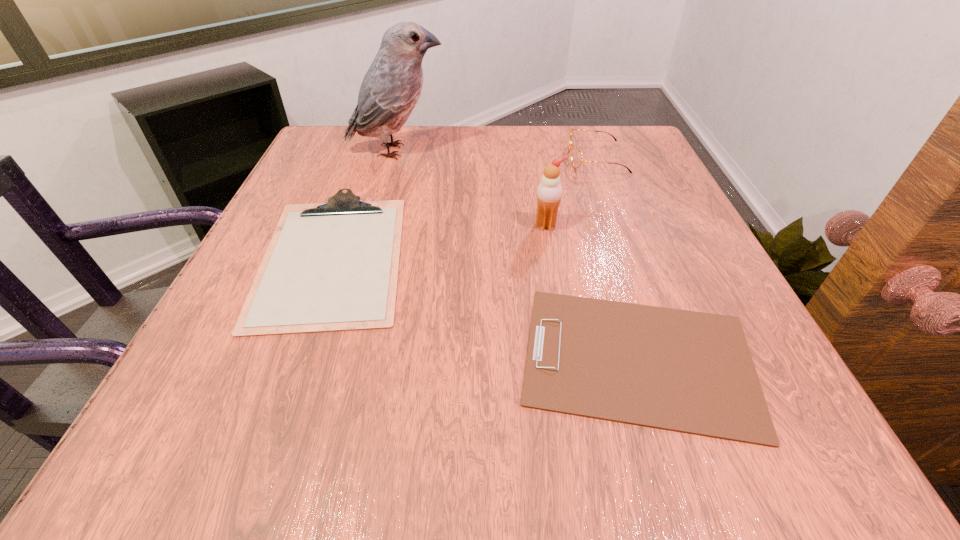
Identify the location of clipboard located in the right edge section of the desktop. The width and height of the screenshot is (960, 540). (692, 372).

The width and height of the screenshot is (960, 540). In order to click on object situated at the far left corner in this screenshot , I will do `click(391, 87)`.

Locate an element on the screen. The image size is (960, 540). object located in the far right corner section of the desktop is located at coordinates (576, 156).

You are a GUI agent. You are given a task and a screenshot of the screen. Output one action in this format:
    pyautogui.click(x=<x>, y=<y>)
    Task: Click on the object located at the near right corner
    Image resolution: width=960 pixels, height=540 pixels.
    Given the screenshot: What is the action you would take?
    pyautogui.click(x=692, y=372)

Locate an element on the screen. This screenshot has width=960, height=540. free space at the far edge of the desktop is located at coordinates (382, 152).

Find the location of a particular element. This screenshot has height=540, width=960. free space at the near edge of the desktop is located at coordinates click(x=305, y=455).

The width and height of the screenshot is (960, 540). In order to click on vacant space at the right edge in this screenshot , I will do `click(679, 265)`.

The image size is (960, 540). In order to click on vacant space at the far left corner in this screenshot , I will do `click(374, 147)`.

Locate an element on the screen. The height and width of the screenshot is (540, 960). empty space that is in between the icecream and the parrot is located at coordinates (471, 188).

Where is `free space between the second tallest object and the parrot`? The image size is (960, 540). free space between the second tallest object and the parrot is located at coordinates (471, 188).